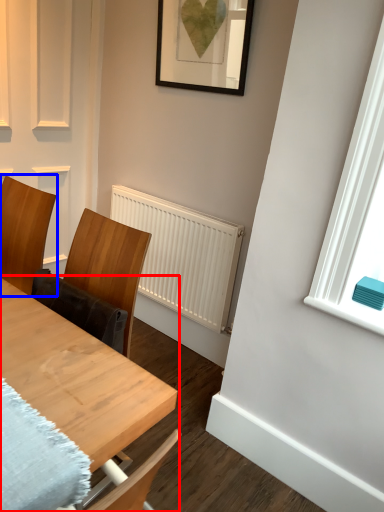
Question: Which of the following is the farthest to the observer, table (highlighted by a red box) or chair (highlighted by a blue box)?

Choices:
 (A) table
 (B) chair

Answer: (B)